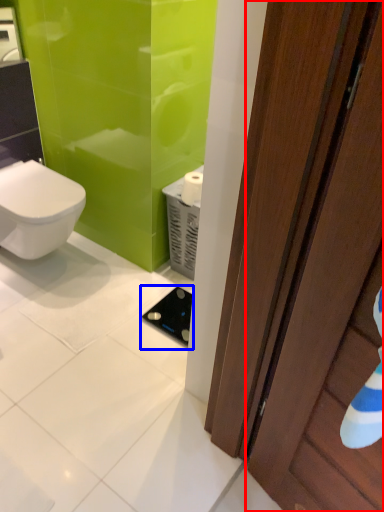
Question: Which point is closer to the camera, door (highlighted by a red box) or appliance (highlighted by a blue box)?

Choices:
 (A) door
 (B) appliance

Answer: (A)